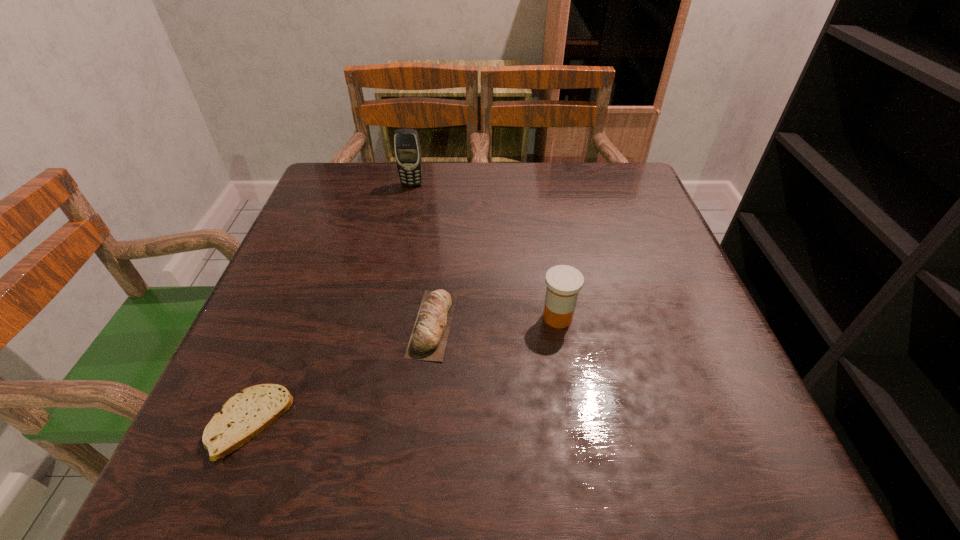
Identify the location of vacant space at the left edge of the desktop. (336, 245).

Find the location of `vacant space at the right edge of the desktop`. vacant space at the right edge of the desktop is located at coordinates (708, 348).

Find the location of a particular element. vacant space at the far left corner of the desktop is located at coordinates point(344,181).

In the image, there is a desktop. In order to click on vacant space at the far right corner in this screenshot , I will do point(628,180).

What are the coordinates of `vacant space at the near right corner of the desktop` in the screenshot? It's located at (707, 474).

Where is `vacant space that's between the right pita bread and the nearer pita bread`? This screenshot has width=960, height=540. vacant space that's between the right pita bread and the nearer pita bread is located at coordinates (342, 374).

Find the location of a particular element. empty space that is in between the cellular telephone and the medicine is located at coordinates (485, 251).

I want to click on vacant area that lies between the shortest object and the rightmost object, so click(x=403, y=370).

At what (x,y) coordinates should I click in order to perform the action: click on vacant point located between the shortest object and the right pita bread. Please return your answer as a coordinate pair (x, y). The height and width of the screenshot is (540, 960). Looking at the image, I should click on (342, 374).

Where is `empty space that is in between the medicine and the leftmost object`? empty space that is in between the medicine and the leftmost object is located at coordinates (403, 370).